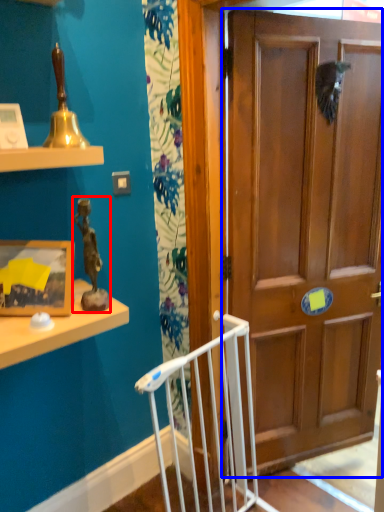
Question: Which object appears farthest to the camera in this image, toy (highlighted by a red box) or door (highlighted by a blue box)?

Choices:
 (A) toy
 (B) door

Answer: (B)